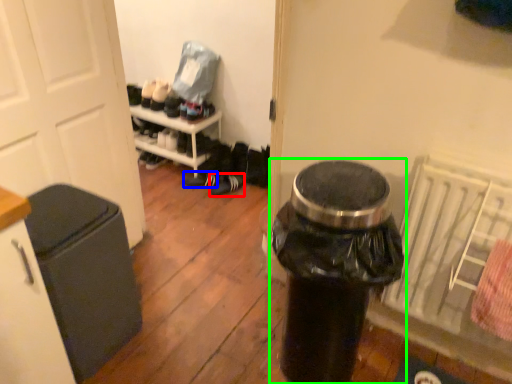
Question: Estimate the real-world distances between objects in this image. Which object is farther from footwear (highlighted by a red box), footwear (highlighted by a blue box) or waste container (highlighted by a green box)?

Choices:
 (A) footwear
 (B) waste container

Answer: (B)